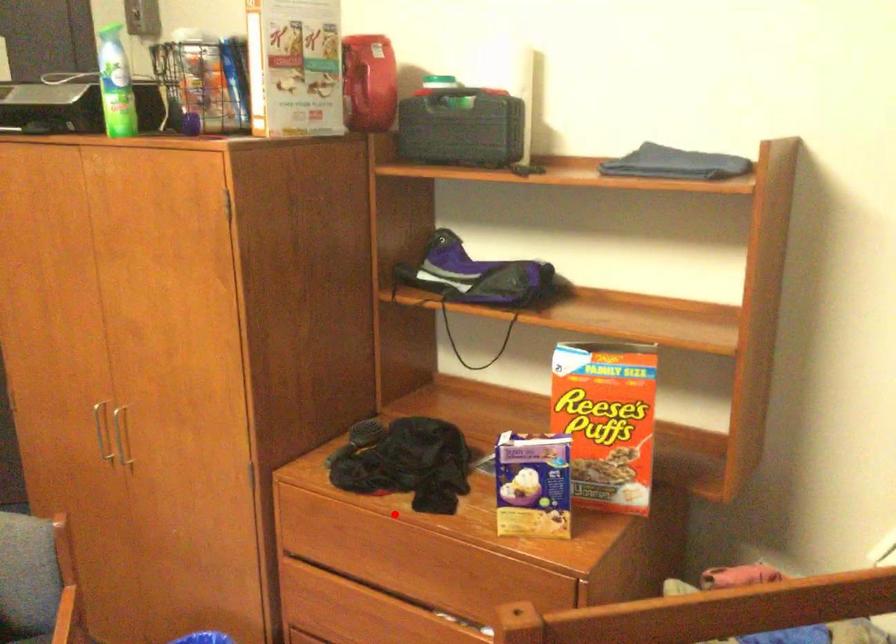
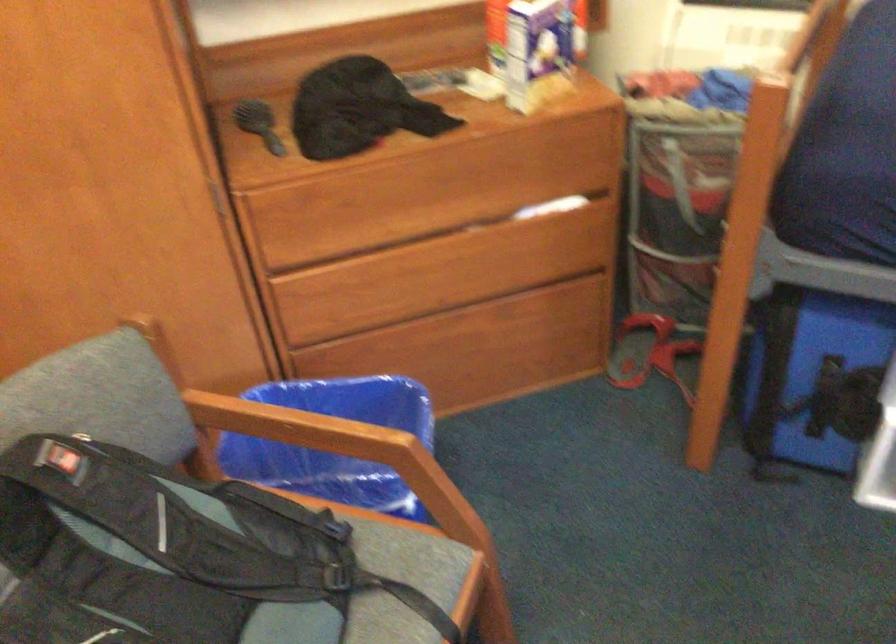
Question: I am providing you with two images of the same scene from different viewpoints. A red point is marked on the first image. At the location where the point appears in image 1, is it still visible in image 2?

Choices:
 (A) Yes
 (B) No

Answer: (A)